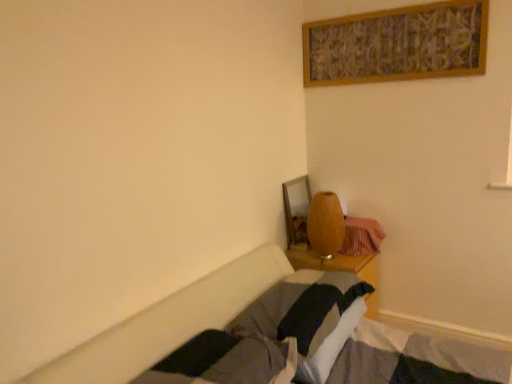
Question: Considering the relative sizes of plaid fabric blanket at lower right and matte yellow lamp at center in the image provided, is plaid fabric blanket at lower right smaller than matte yellow lamp at center?

Choices:
 (A) yes
 (B) no

Answer: (A)

Question: Considering the relative positions of plaid fabric blanket at lower right and matte yellow lamp at center in the image provided, is plaid fabric blanket at lower right to the left of matte yellow lamp at center from the viewer's perspective?

Choices:
 (A) yes
 (B) no

Answer: (B)

Question: Would you consider plaid fabric blanket at lower right to be distant from matte yellow lamp at center?

Choices:
 (A) yes
 (B) no

Answer: (B)

Question: Does plaid fabric blanket at lower right have a larger size compared to matte yellow lamp at center?

Choices:
 (A) no
 (B) yes

Answer: (A)

Question: Is plaid fabric blanket at lower right thinner than matte yellow lamp at center?

Choices:
 (A) no
 (B) yes

Answer: (A)

Question: From the image's perspective, is soft gray pillow at center above or below plaid fabric blanket at lower right?

Choices:
 (A) above
 (B) below

Answer: (B)

Question: Considering the positions of soft gray pillow at center and plaid fabric blanket at lower right in the image, is soft gray pillow at center bigger or smaller than plaid fabric blanket at lower right?

Choices:
 (A) big
 (B) small

Answer: (A)

Question: In terms of width, does soft gray pillow at center look wider or thinner when compared to plaid fabric blanket at lower right?

Choices:
 (A) thin
 (B) wide

Answer: (B)

Question: Would you say soft gray pillow at center is inside or outside plaid fabric blanket at lower right?

Choices:
 (A) outside
 (B) inside

Answer: (A)

Question: Considering their positions, is matte yellow lamp at center located in front of or behind soft gray pillow at center?

Choices:
 (A) front
 (B) behind

Answer: (B)

Question: Does point (340, 243) appear closer or farther from the camera than point (335, 340)?

Choices:
 (A) closer
 (B) farther

Answer: (B)

Question: From a real-world perspective, is matte yellow lamp at center physically located above or below soft gray pillow at center?

Choices:
 (A) below
 (B) above

Answer: (B)

Question: From the image's perspective, is matte yellow lamp at center positioned above or below soft gray pillow at center?

Choices:
 (A) below
 (B) above

Answer: (B)

Question: In the image, is soft gray pillow at center positioned in front of or behind matte yellow lamp at center?

Choices:
 (A) front
 (B) behind

Answer: (A)

Question: Would you say soft gray pillow at center is to the left or to the right of matte yellow lamp at center in the picture?

Choices:
 (A) left
 (B) right

Answer: (A)